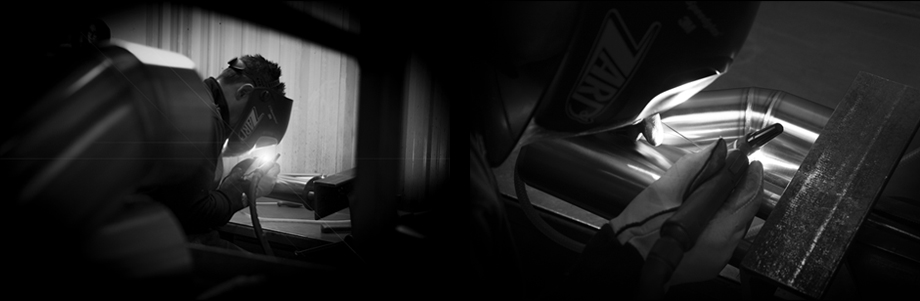
Identify the location of light. (260, 153).